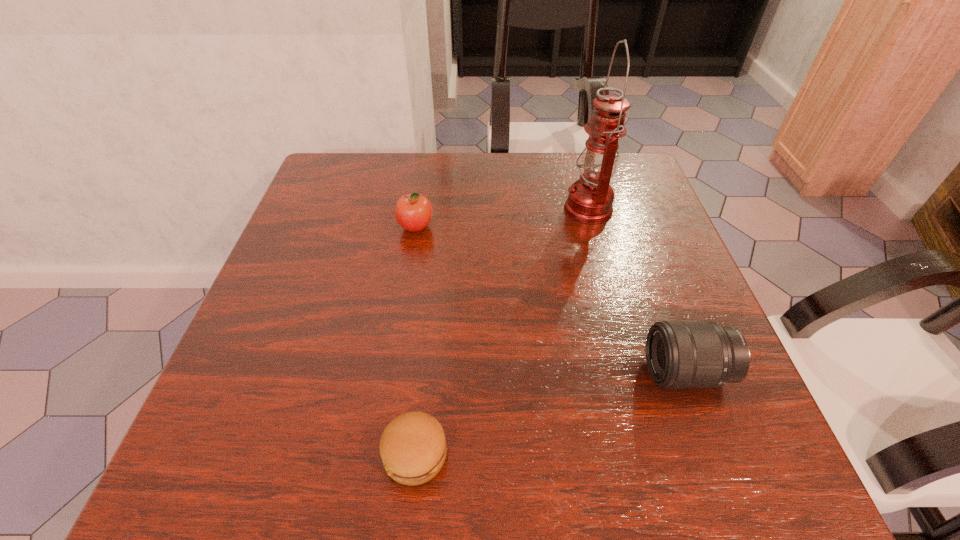
Where is `free point between the shortest object and the telephoto lens`? The height and width of the screenshot is (540, 960). free point between the shortest object and the telephoto lens is located at coordinates (551, 413).

Find the location of a particular element. Image resolution: width=960 pixels, height=540 pixels. empty location between the tallest object and the apple is located at coordinates (502, 218).

Point out which object is positioned as the nearest to the third farthest object. Please provide its 2D coordinates. Your answer should be formatted as a tuple, i.e. [(x, y)], where the tuple contains the x and y coordinates of a point satisfying the conditions above.

[(590, 200)]

Identify which object is located as the second nearest to the nearest object. Please provide its 2D coordinates. Your answer should be formatted as a tuple, i.e. [(x, y)], where the tuple contains the x and y coordinates of a point satisfying the conditions above.

[(413, 211)]

At what (x,y) coordinates should I click in order to perform the action: click on free spot that satisfies the following two spatial constraints: 1. on the surface of the third farthest object; 2. on the front side of the hamburger. Please return your answer as a coordinate pair (x, y). Looking at the image, I should click on (716, 454).